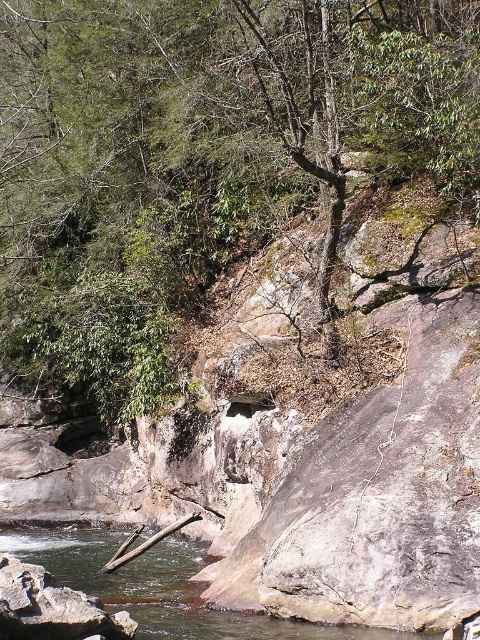
You are an environmental scientist assessing the area. You need to determine which object occupies more visual space in the scene. Which is larger in size between the green leafy tree at upper center and the clear water at stream center?

The green leafy tree at upper center is bigger than the clear water at stream center, so the green leafy tree at upper center occupies more visual space in the scene.

You are standing at the edge of the river near the fallen tree branch in the foreground. You want to reach the green leafy tree at upper center located at point (x=199, y=157). Which direction should you head to from your current position?

You should head towards the upper center direction to reach the green leafy tree at upper center located at point (x=199, y=157).